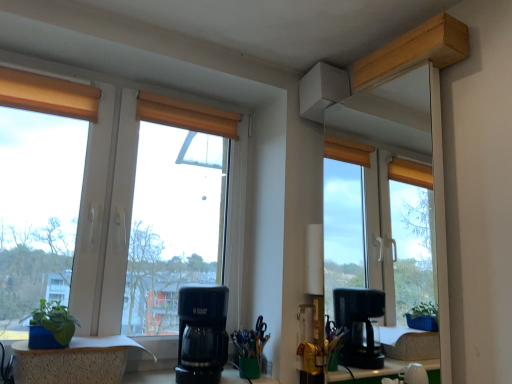
Identify the location of free location above wooden blind at center (from a real-world perspective). (192, 100).